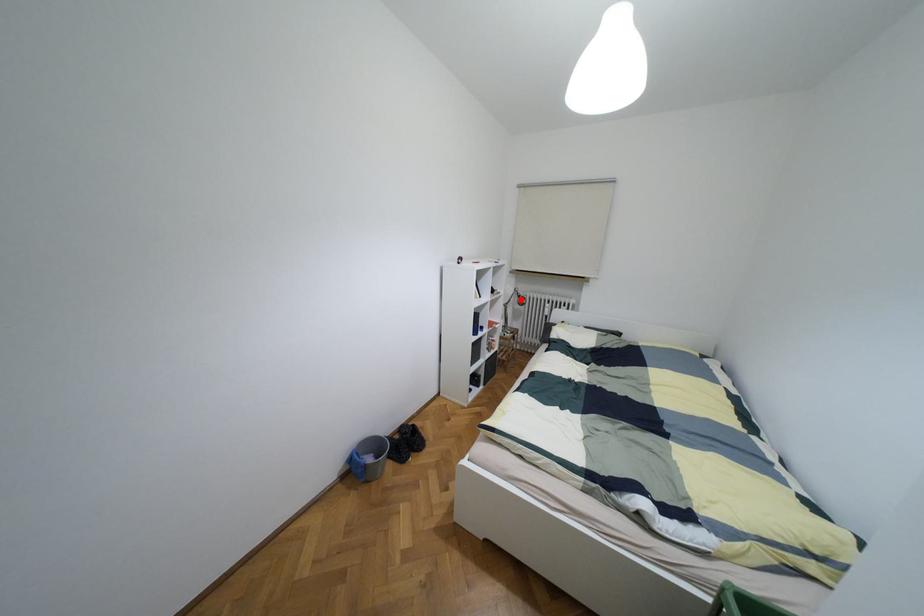
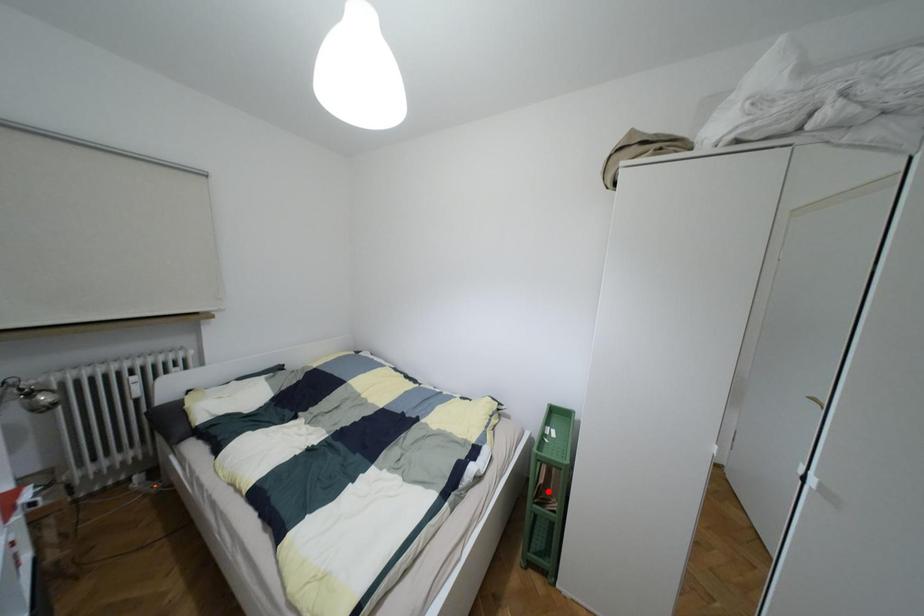
I am providing you with two images of the same scene from different viewpoints. A red point is marked on the first image and another point is marked on the second image. Does the point marked in image1 correspond to the same location as the one in image2?

No